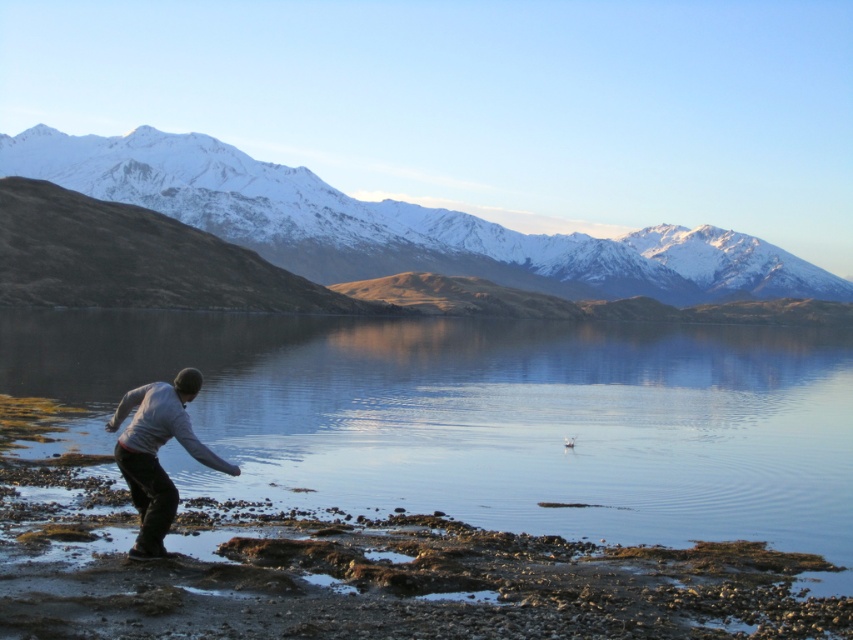
You are a photographer planning to capture the scene with the smooth water at center and the gray cotton sweater at lower left. If you want to ensure both elements are in the frame, which object should you prioritize framing first based on their sizes?

The smooth water at center has a larger width than the gray cotton sweater at lower left, so you should prioritize framing the smooth water at center first to accommodate its larger size.

You are standing on the rocky shoreline and want to look at both the smooth water at center and the snowy rocky mountain at upper center. Which one will you have to look down at?

You will have to look down at the smooth water at center because it is shorter than the snowy rocky mountain at upper center.